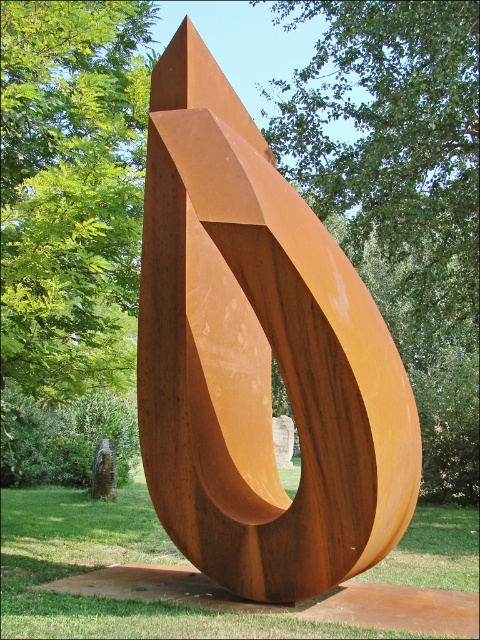
Who is positioned more to the right, green leafy tree at upper left or rusty metal sculpture at center?

Positioned to the right is rusty metal sculpture at center.

Does point (43, 342) come farther from viewer compared to point (450, 573)?

That is False.

In order to click on green leafy tree at upper left in this screenshot , I will do `click(71, 189)`.

Can you confirm if rusty metal abstract at center is positioned to the right of rusty metal sculpture at center?

Incorrect, rusty metal abstract at center is not on the right side of rusty metal sculpture at center.

Which is behind, point (188, 477) or point (72, 600)?

The point (188, 477) is behind.

Which is in front, point (370, 493) or point (149, 609)?

Point (370, 493) is in front.

What are the coordinates of `rusty metal abstract at center` in the screenshot? It's located at (259, 356).

Is rusty metal abstract at center to the right of green leafy tree at upper left from the viewer's perspective?

Correct, you'll find rusty metal abstract at center to the right of green leafy tree at upper left.

Is point (327, 541) behind point (32, 88)?

No.

Identify the location of rusty metal abstract at center. (259, 356).